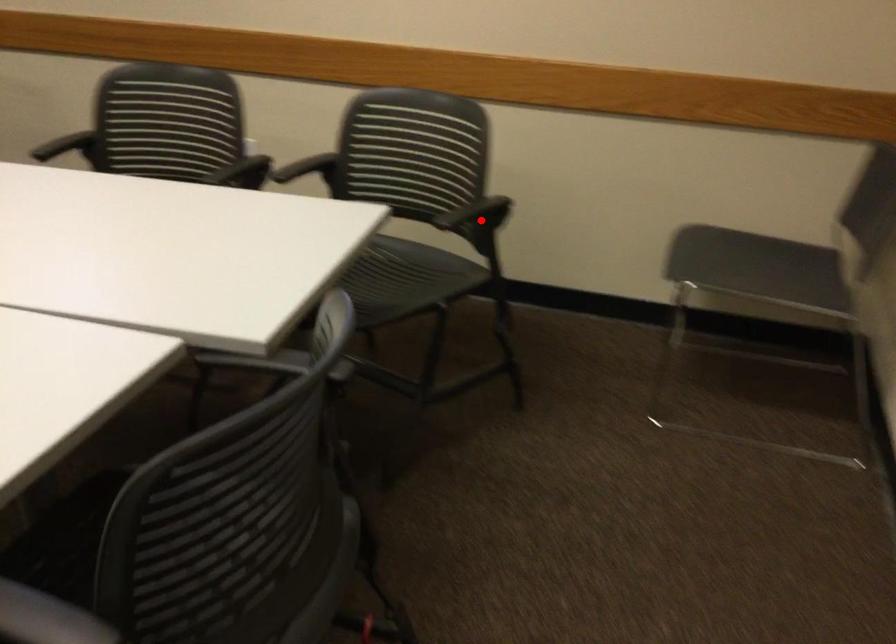
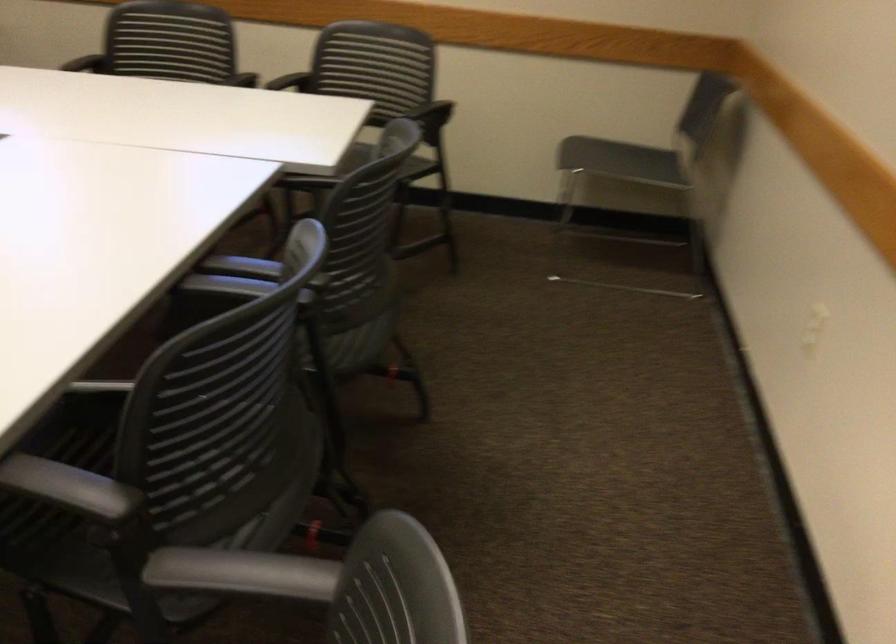
Locate, in the second image, the point that corresponds to the highlighted location in the first image.

(433, 118)